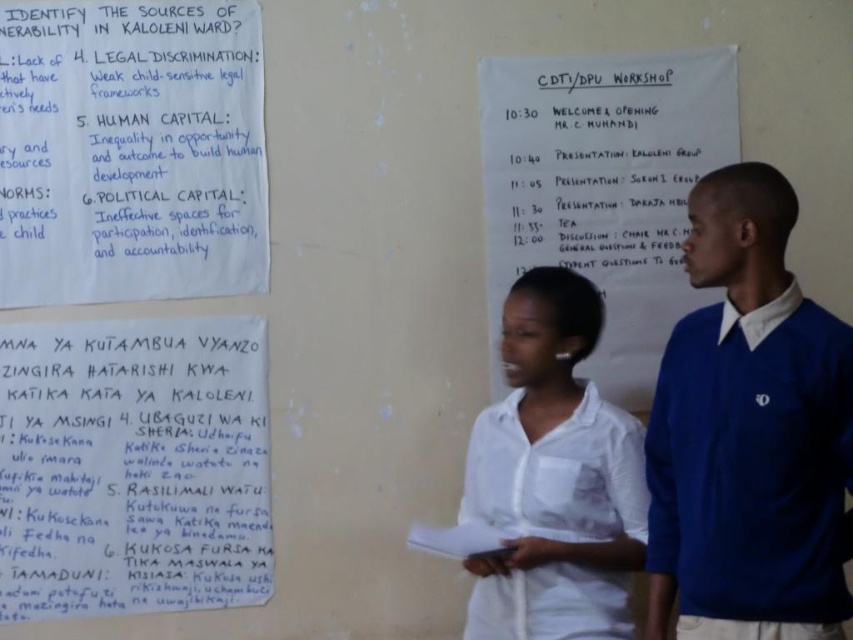
Does blue fabric sweater at right have a lesser height compared to white paper at center?

Yes, blue fabric sweater at right is shorter than white paper at center.

Can you confirm if blue fabric sweater at right is positioned above white paper at center?

Actually, blue fabric sweater at right is below white paper at center.

This screenshot has height=640, width=853. I want to click on blue fabric sweater at right, so click(x=749, y=428).

Image resolution: width=853 pixels, height=640 pixels. Identify the location of blue fabric sweater at right. tap(749, 428).

Consider the image. Does handwritten paper at center appear under white cotton shirt at center?

Correct, handwritten paper at center is located below white cotton shirt at center.

Can you confirm if handwritten paper at center is shorter than white cotton shirt at center?

Indeed, handwritten paper at center has a lesser height compared to white cotton shirt at center.

Measure the distance between point (206, 483) and camera.

2.33 meters

Locate an element on the screen. Image resolution: width=853 pixels, height=640 pixels. handwritten paper at center is located at coordinates (132, 467).

In the scene shown: Who is taller, handwritten paper at center or white paper at center?

With more height is white paper at center.

Can you confirm if handwritten paper at center is wider than white paper at center?

No, handwritten paper at center is not wider than white paper at center.

Between point (260, 532) and point (489, 348), which one is positioned behind?

Point (489, 348)

The image size is (853, 640). In order to click on handwritten paper at center in this screenshot , I will do `click(132, 467)`.